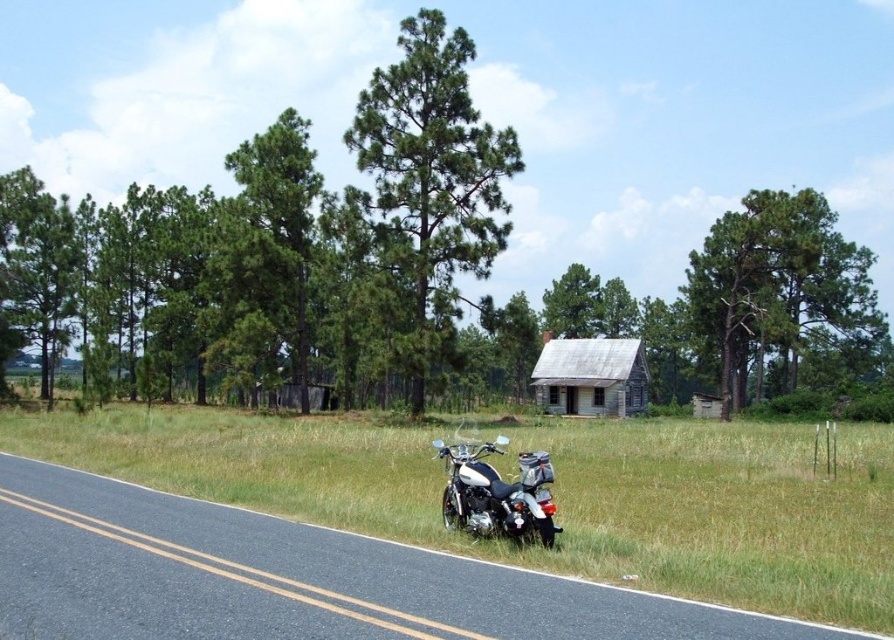
Question: Does white matte motorbike at center have a lesser width compared to weathered wood cabin at center?

Choices:
 (A) no
 (B) yes

Answer: (B)

Question: Is green textured tree at upper right further to camera compared to green matte tree at center?

Choices:
 (A) no
 (B) yes

Answer: (B)

Question: Is the position of green grass at lower center more distant than that of white matte motorbike at center?

Choices:
 (A) yes
 (B) no

Answer: (B)

Question: Estimate the real-world distances between objects in this image. Which object is farther from the green matte tree at center?

Choices:
 (A) green grass at lower center
 (B) white matte motorbike at center
 (C) weathered wood cabin at center
 (D) green textured tree at upper right

Answer: (D)

Question: Among these points, which one is farthest from the camera?

Choices:
 (A) (727, 419)
 (B) (549, 378)
 (C) (308, 396)
 (D) (541, 525)

Answer: (B)

Question: Which point is closer to the camera taking this photo?

Choices:
 (A) (439, 195)
 (B) (454, 476)
 (C) (537, 397)

Answer: (B)